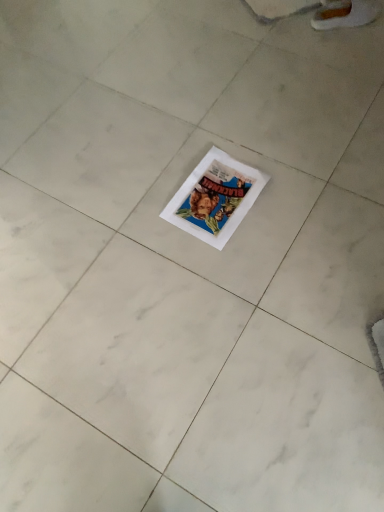
You are a GUI agent. You are given a task and a screenshot of the screen. Output one action in this format:
    pyautogui.click(x=<x>, y=<y>)
    Task: Click on the blank space to the left of white rubber shoe at upper right
    This screenshot has height=512, width=384.
    Given the screenshot: What is the action you would take?
    pyautogui.click(x=297, y=32)